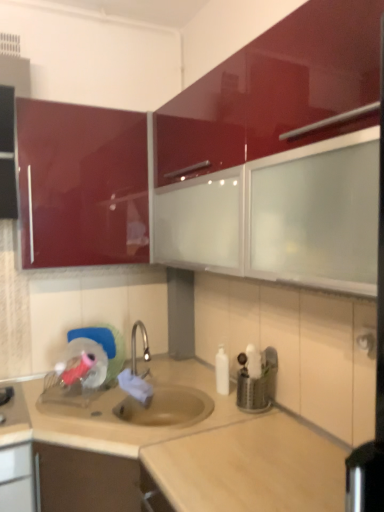
Question: From the image's perspective, is metallic silver utensil holder at center located above or below beige laminate countertop at center?

Choices:
 (A) above
 (B) below

Answer: (A)

Question: Visually, is metallic silver utensil holder at center positioned to the left or to the right of beige laminate countertop at center?

Choices:
 (A) right
 (B) left

Answer: (A)

Question: Based on their relative distances, which object is farther from the metallic silver utensil holder at center?

Choices:
 (A) beige laminate countertop at center
 (B) glossy red cabinet at upper left, which appears as the second cabinetry when viewed from the right
 (C) glossy red cabinet at upper center, the first cabinetry positioned from the right

Answer: (B)

Question: Which is nearer to the beige laminate countertop at center?

Choices:
 (A) metallic silver utensil holder at center
 (B) glossy red cabinet at upper center, which is the second cabinetry from left to right
 (C) glossy red cabinet at upper left, which appears as the second cabinetry when viewed from the right

Answer: (A)